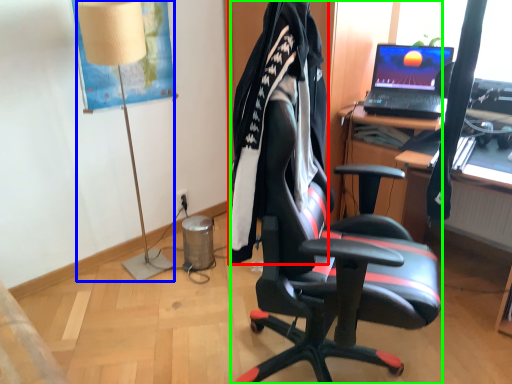
Question: Estimate the real-world distances between objects in this image. Which object is closer to clothing (highlighted by a red box), lamp (highlighted by a blue box) or chair (highlighted by a green box)?

Choices:
 (A) lamp
 (B) chair

Answer: (B)